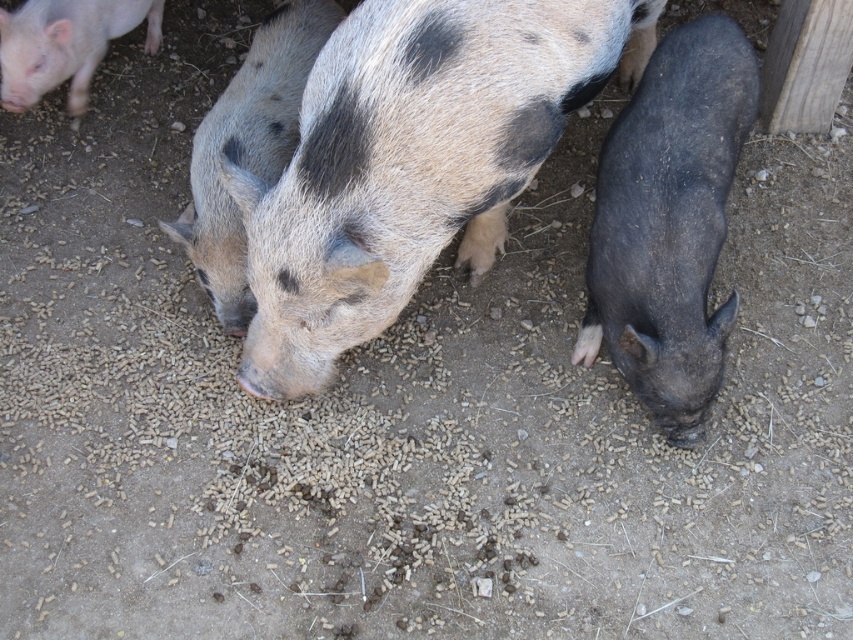
You are a farmer checking the feeding area. You notice the speckled fur pig at center and the speckled fur piglet at center. Which one is wider?

The speckled fur pig at center is wider than the speckled fur piglet at center according to the description.

You are a farmer checking the pigs in the pen. You notice the speckled fur pig at center and the shiny black piglet at right. Which one is wider?

The speckled fur pig at center is wider than the shiny black piglet at right according to the description.